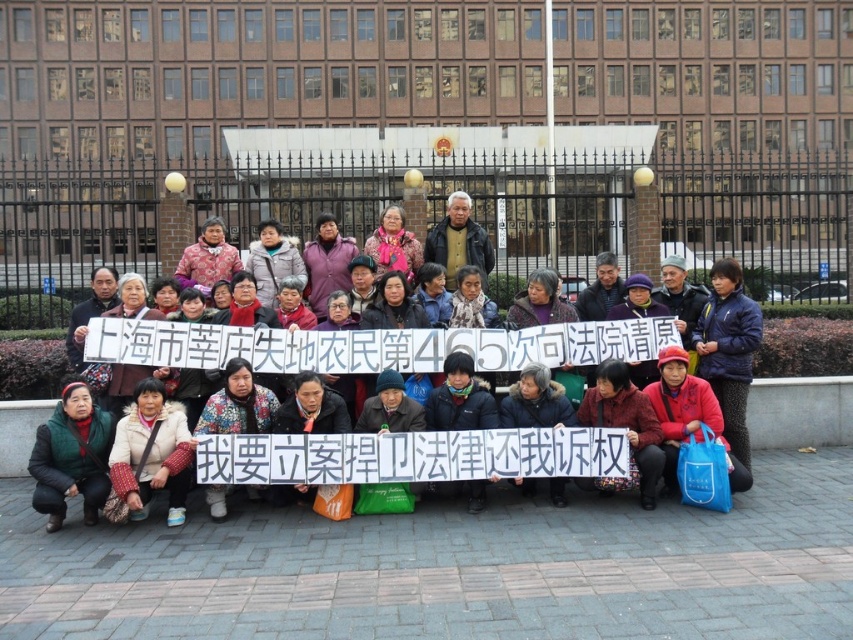
Which is in front, point (108, 456) or point (79, 484)?

Point (79, 484) is in front.

Does point (149, 380) come behind point (56, 468)?

Yes, point (149, 380) is behind point (56, 468).

Identify the location of fluffy beige coat at lower center. tap(149, 456).

Where is `blue fleece jacket at center`? The image size is (853, 640). blue fleece jacket at center is located at coordinates (728, 349).

Who is taller, blue fleece jacket at center or dark gray jacket at center?

Standing taller between the two is blue fleece jacket at center.

The height and width of the screenshot is (640, 853). Find the location of `blue fleece jacket at center`. blue fleece jacket at center is located at coordinates (728, 349).

Find the location of `blue fleece jacket at center`. blue fleece jacket at center is located at coordinates (728, 349).

Which is more to the right, dark blue jacket at center or fluffy beige coat at lower center?

dark blue jacket at center is more to the right.

Between dark blue jacket at center and fluffy beige coat at lower center, which one is positioned higher?

Positioned higher is fluffy beige coat at lower center.

Is point (250, 333) farther from camera compared to point (190, 461)?

Yes, point (250, 333) is behind point (190, 461).

Identify the location of dark blue jacket at center. (376, 346).